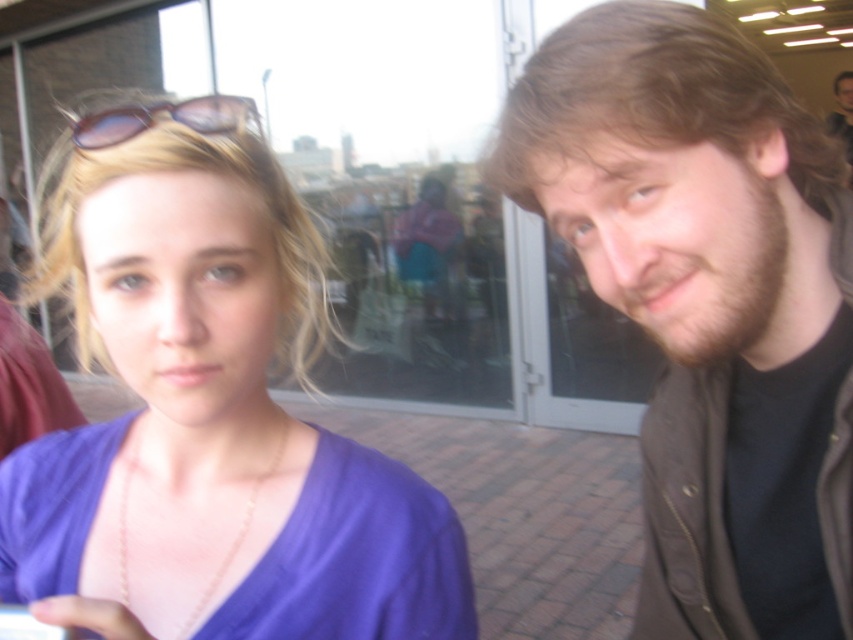
You are a photographer trying to capture a clear shot of the two people in the scene. The brown hair at right and brown hair at upper right are both in your viewfinder. Which one is positioned lower in the frame?

The brown hair at right is positioned lower in the frame than the brown hair at upper right.

You are a photographer trying to capture a closeup of the sunglasses at upper left and the brown hair at upper right. Which object is narrower in the image?

The sunglasses at upper left has a lesser width compared to brown hair at upper right, so the sunglasses at upper left is narrower.

Looking at this image, you are standing in the public space shown in the image. You see two people. The first person is the one with the purple top and V neckline, and the second person is the one with the brown hair and beard. There is a specific point marked at coordinates (706, 301). Which of the two people is closer to this point?

The brown hair at right is located at point (706, 301), so the person on the right with brown hair and beard is closer to this point.